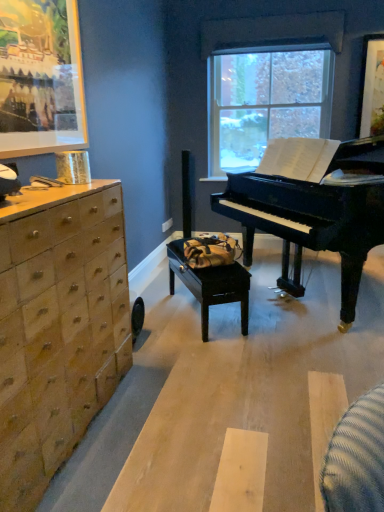
Locate an element on the screen. This screenshot has width=384, height=512. vacant space to the right of wooden chest of drawers at left is located at coordinates (195, 428).